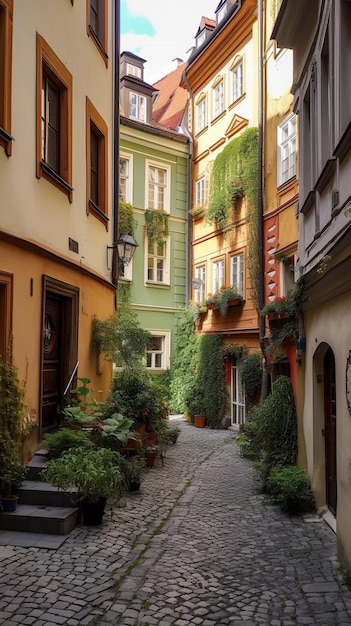
I want to click on window, so click(230, 274), click(214, 280), click(196, 285), click(162, 265), click(162, 341), click(238, 404), click(8, 322).